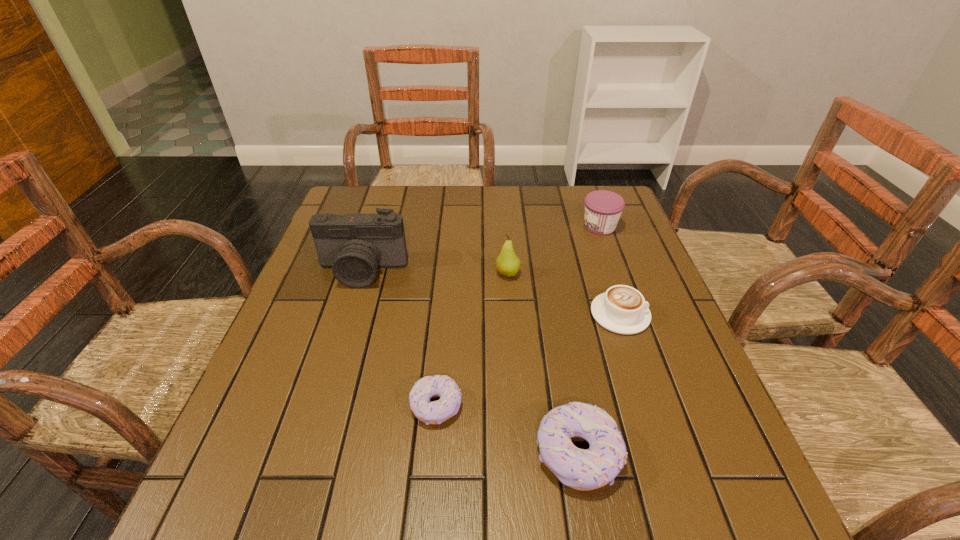
Find the location of a particular element. The height and width of the screenshot is (540, 960). vacant space that satisfies the following two spatial constraints: 1. at the lens of the tallest object; 2. on the right side of the shorter doughnut is located at coordinates (321, 406).